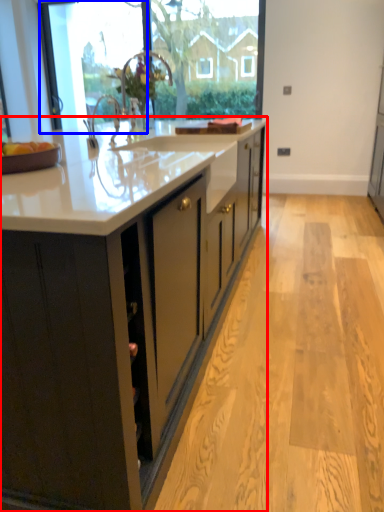
Question: Which object appears closest to the camera in this image, cabinetry (highlighted by a red box) or glass door (highlighted by a blue box)?

Choices:
 (A) cabinetry
 (B) glass door

Answer: (A)